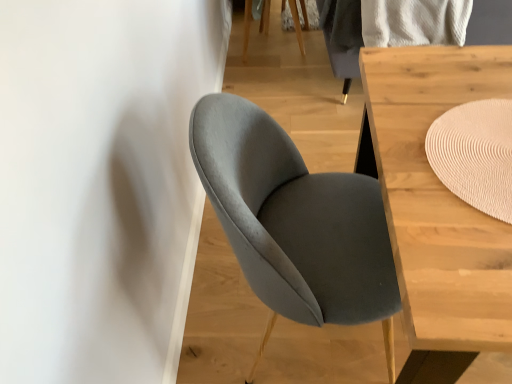
Question: Is beige woven mat at upper right aimed at light wood table at center?

Choices:
 (A) yes
 (B) no

Answer: (A)

Question: Is there a large distance between beige woven mat at upper right and light wood table at center?

Choices:
 (A) yes
 (B) no

Answer: (B)

Question: Is the depth of beige woven mat at upper right less than that of light wood table at center?

Choices:
 (A) yes
 (B) no

Answer: (B)

Question: From a real-world perspective, is beige woven mat at upper right physically above light wood table at center?

Choices:
 (A) yes
 (B) no

Answer: (A)

Question: Does beige woven mat at upper right appear on the right side of light wood table at center?

Choices:
 (A) yes
 (B) no

Answer: (B)

Question: Does beige woven mat at upper right have a larger size compared to light wood table at center?

Choices:
 (A) no
 (B) yes

Answer: (A)

Question: Is light wood table at center looking in the opposite direction of suede gray chair at center?

Choices:
 (A) no
 (B) yes

Answer: (A)

Question: Is light wood table at center not within suede gray chair at center?

Choices:
 (A) yes
 (B) no

Answer: (A)

Question: Is light wood table at center closer to camera compared to suede gray chair at center?

Choices:
 (A) yes
 (B) no

Answer: (A)

Question: From a real-world perspective, is light wood table at center located higher than suede gray chair at center?

Choices:
 (A) no
 (B) yes

Answer: (A)

Question: From the image's perspective, is light wood table at center located above suede gray chair at center?

Choices:
 (A) yes
 (B) no

Answer: (B)

Question: From the image's perspective, is light wood table at center below suede gray chair at center?

Choices:
 (A) no
 (B) yes

Answer: (B)

Question: Does suede gray chair at center have a smaller size compared to beige woven mat at upper right?

Choices:
 (A) yes
 (B) no

Answer: (B)